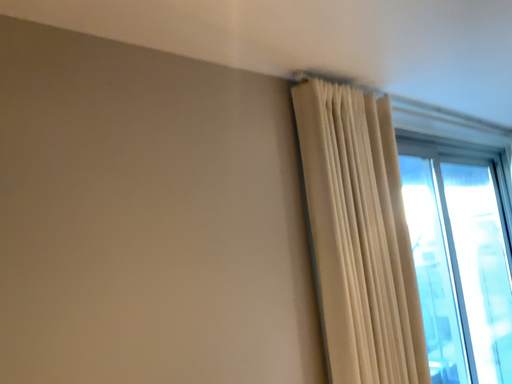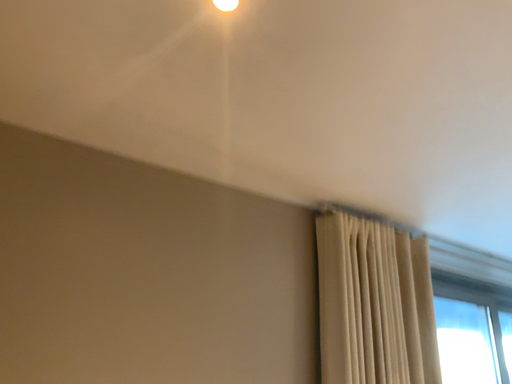
Question: How did the camera likely rotate when shooting the video?

Choices:
 (A) rotated downward
 (B) rotated upward

Answer: (B)